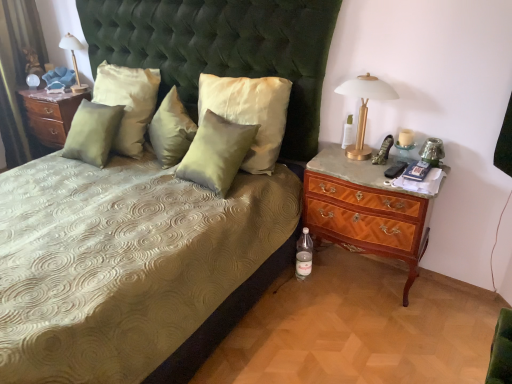
The height and width of the screenshot is (384, 512). In order to click on free space in front of mahogany wood nightstand at right, the second nightstand from the left in this screenshot , I will do `click(375, 334)`.